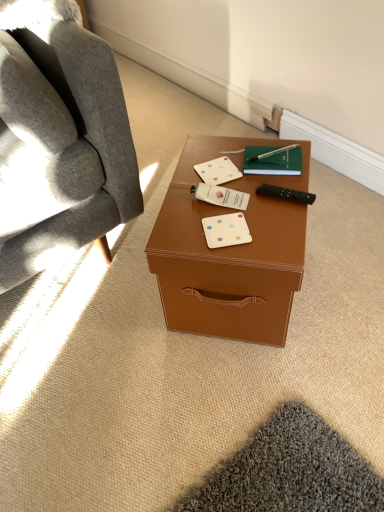
This screenshot has height=512, width=384. I want to click on vacant area that lies between black plastic remote control at right and white matte business card at center, the 1th business card viewed from the front, so (x=263, y=215).